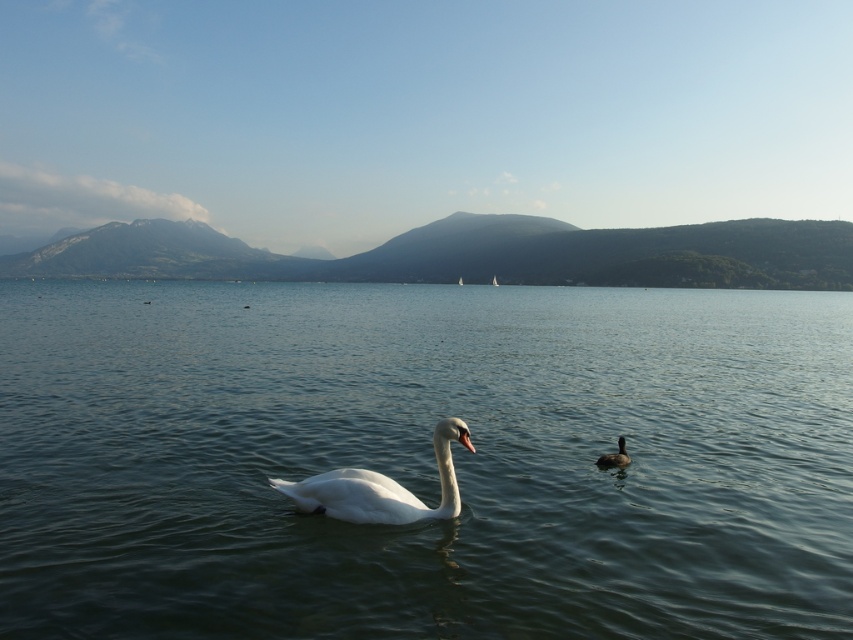
Question: Among these objects, which one is farthest from the camera?

Choices:
 (A) clear water at center
 (B) white glossy swan at center
 (C) dark brown glossy duck at right

Answer: (C)

Question: Is white glossy swan at center in front of dark brown glossy duck at right?

Choices:
 (A) no
 (B) yes

Answer: (B)

Question: Which object is the closest to the clear water at center?

Choices:
 (A) dark brown glossy duck at right
 (B) white glossy swan at center

Answer: (B)

Question: Is clear water at center further to camera compared to dark brown glossy duck at right?

Choices:
 (A) no
 (B) yes

Answer: (A)

Question: Considering the real-world distances, which object is farthest from the white glossy swan at center?

Choices:
 (A) dark brown glossy duck at right
 (B) clear water at center

Answer: (B)

Question: Is clear water at center closer to camera compared to white glossy swan at center?

Choices:
 (A) no
 (B) yes

Answer: (B)